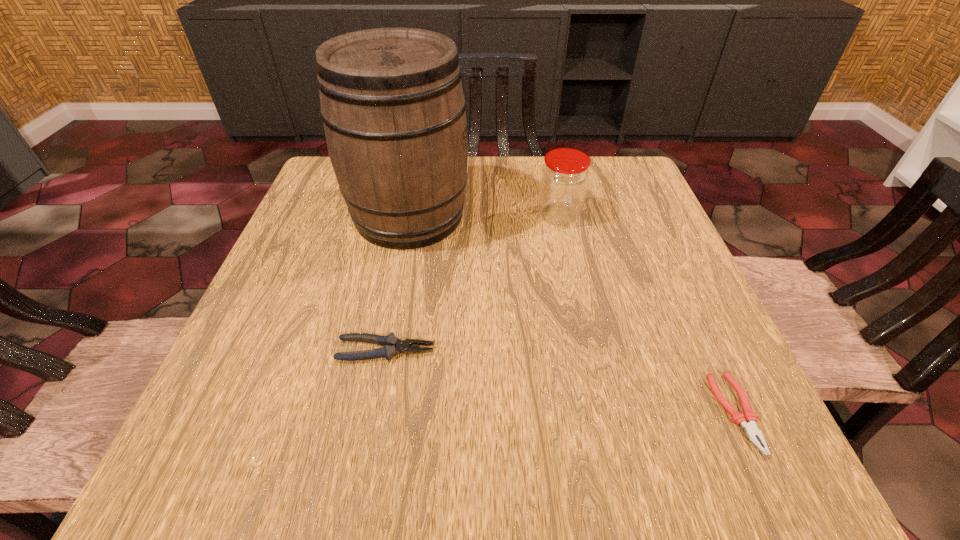
This screenshot has height=540, width=960. In the image, there is a desktop. In order to click on vacant space at the left edge in this screenshot , I will do `click(268, 365)`.

In the image, there is a desktop. Find the location of `free space at the right edge`. free space at the right edge is located at coordinates (691, 294).

Where is `vacant area at the far left corner`? The width and height of the screenshot is (960, 540). vacant area at the far left corner is located at coordinates (311, 207).

Identify the location of free space at the far right corner of the desktop. The width and height of the screenshot is (960, 540). (604, 181).

Locate an element on the screen. Image resolution: width=960 pixels, height=540 pixels. free space between the wine bucket and the jar is located at coordinates (484, 216).

Identify the location of free space between the second tallest object and the tallest object. The width and height of the screenshot is (960, 540). (484, 216).

The width and height of the screenshot is (960, 540). I want to click on vacant space that is in between the wine bucket and the shortest object, so click(x=572, y=314).

Where is `vacant point located between the shortest object and the farther pliers`? Image resolution: width=960 pixels, height=540 pixels. vacant point located between the shortest object and the farther pliers is located at coordinates (561, 381).

You are a GUI agent. You are given a task and a screenshot of the screen. Output one action in this format:
    pyautogui.click(x=<x>, y=<y>)
    Task: Click on the vacant space that is in between the second object from right to left and the wine bucket
    The height and width of the screenshot is (540, 960).
    Given the screenshot: What is the action you would take?
    pyautogui.click(x=484, y=216)

Image resolution: width=960 pixels, height=540 pixels. What are the coordinates of `vacant space that is in between the nearest object and the third object from left to right` in the screenshot? It's located at (647, 314).